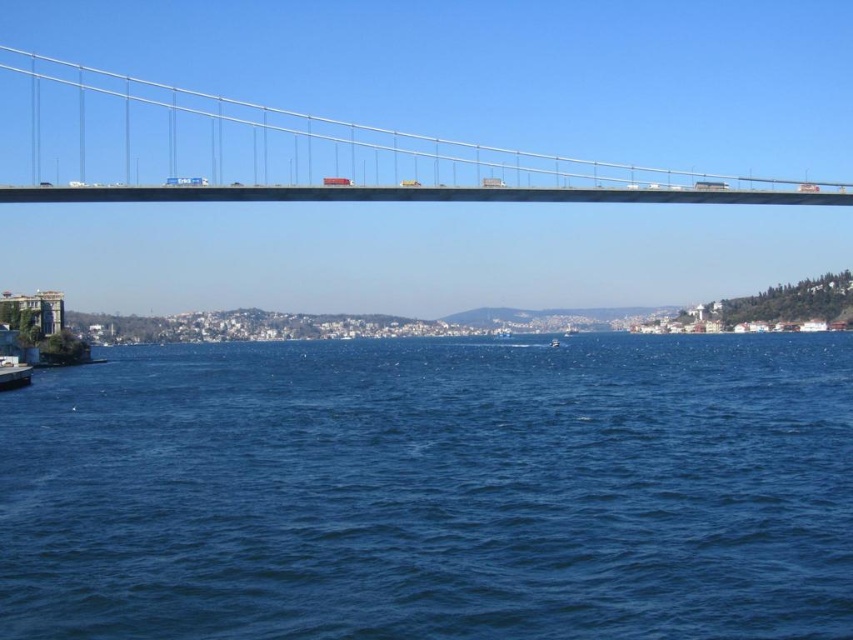
You are standing on the shore looking at the blue water at center and the metallic gray suspension bridge at upper center. Which object is closer to you?

The blue water at center is closer to the viewer than the metallic gray suspension bridge at upper center.

You are a photographer planning to capture the blue water at center and the metallic gray suspension bridge at upper center in a single shot. Which object will occupy more of the frame in your photograph?

The metallic gray suspension bridge at upper center will occupy more of the frame because it is larger than the blue water at center according to the description.

Based on the photo, you are a photographer planning to capture the blue water at center and the metallic gray suspension bridge at upper center in a single shot. Based on their positions, which object will appear closer to the bottom of your photo?

The blue water at center will appear closer to the bottom of the photo because it has a lesser height compared to the metallic gray suspension bridge at upper center.